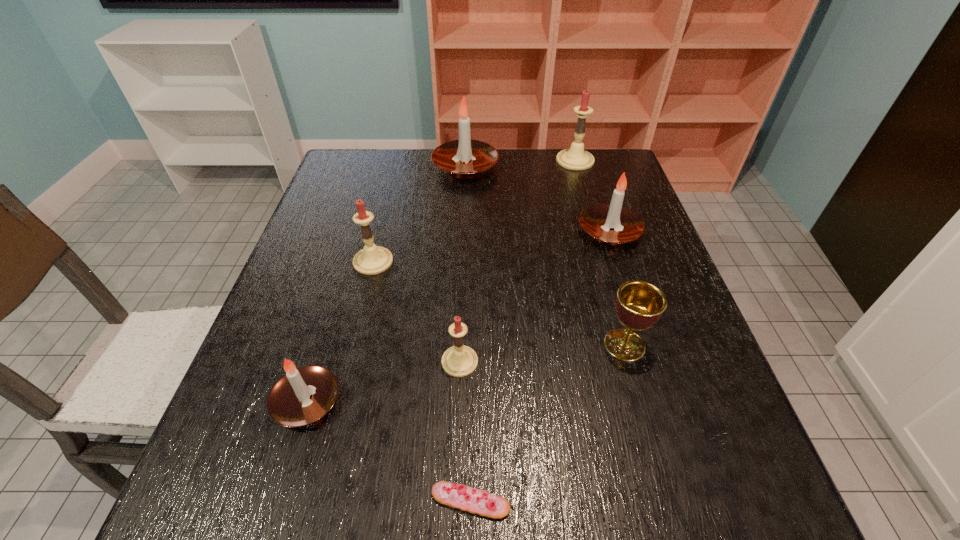
Locate an element on the screen. free spot that satisfies the following two spatial constraints: 1. on the back side of the nearest white candle; 2. on the left side of the biggest red candle is located at coordinates (380, 161).

Where is `free location that satisfies the following two spatial constraints: 1. on the back side of the golden chalice; 2. on the left side of the nearest white candle`? The height and width of the screenshot is (540, 960). free location that satisfies the following two spatial constraints: 1. on the back side of the golden chalice; 2. on the left side of the nearest white candle is located at coordinates (324, 345).

The image size is (960, 540). Find the location of `vacant space that satisfies the following two spatial constraints: 1. on the back side of the chalice; 2. on the left side of the rightmost white candle`. vacant space that satisfies the following two spatial constraints: 1. on the back side of the chalice; 2. on the left side of the rightmost white candle is located at coordinates (592, 232).